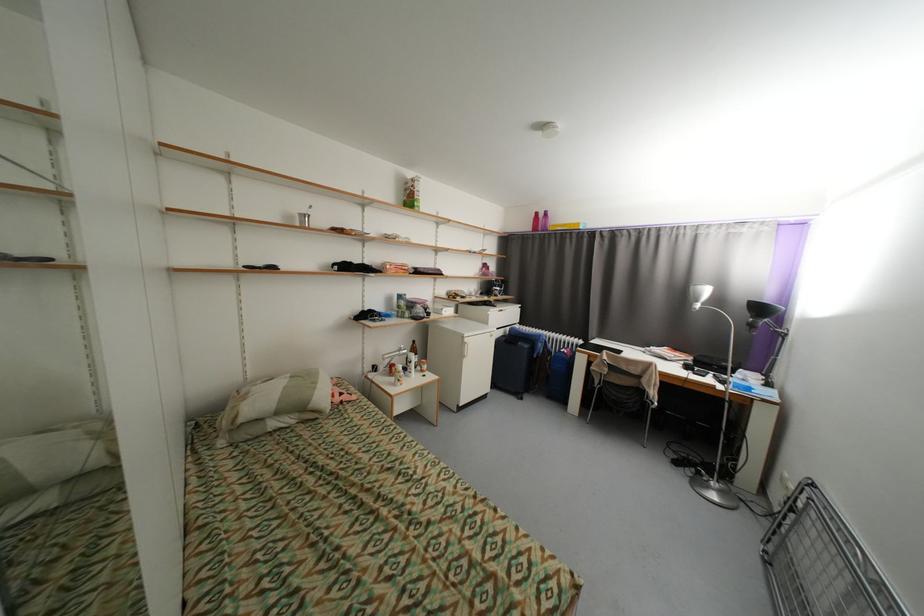
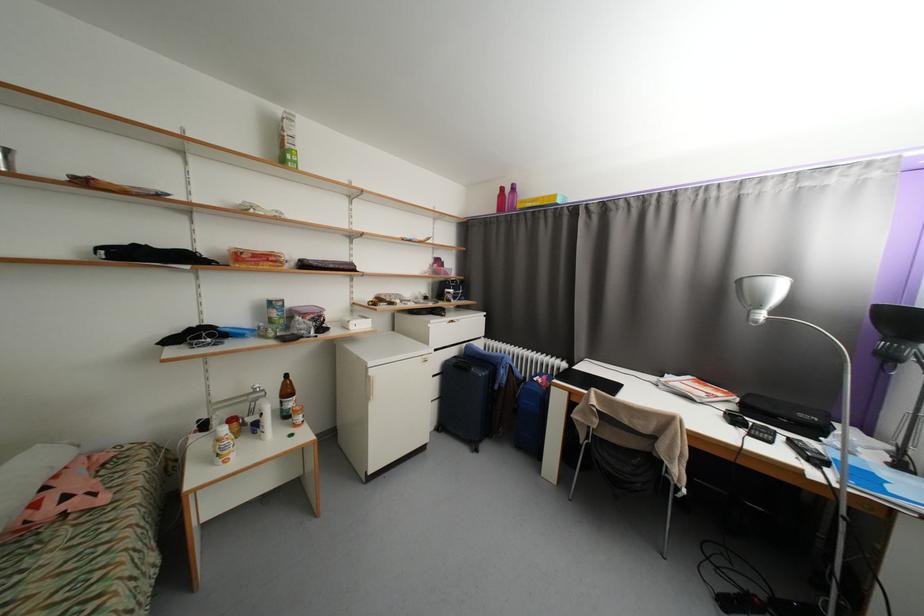
The point at (542, 215) is marked in the first image. Where is the corresponding point in the second image?

(508, 190)